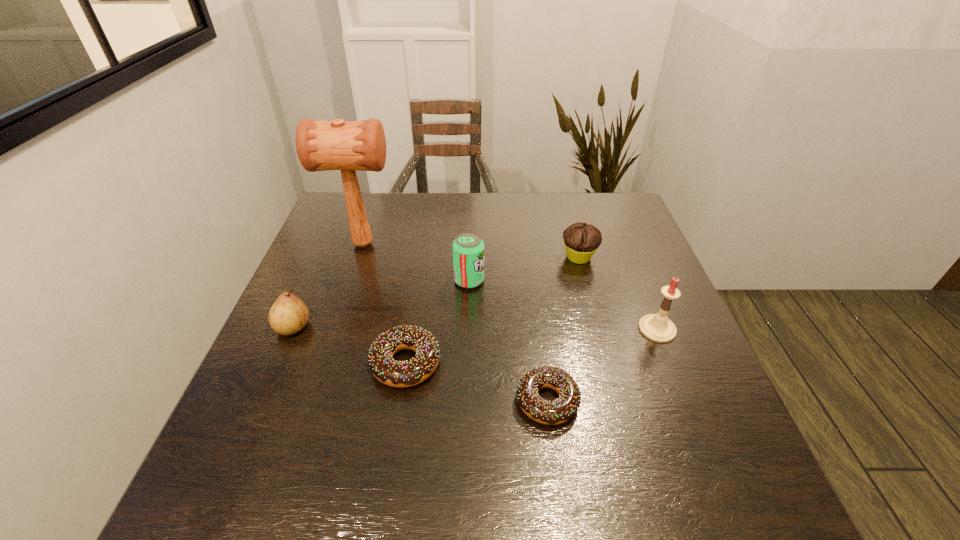
This screenshot has width=960, height=540. I want to click on pear, so click(x=289, y=314).

Where is `vacant space located on the left of the second shortest object`? The image size is (960, 540). vacant space located on the left of the second shortest object is located at coordinates (269, 363).

The width and height of the screenshot is (960, 540). Find the location of `free space located 0.210m on the left of the shortest object`. free space located 0.210m on the left of the shortest object is located at coordinates (410, 401).

Locate an element on the screen. free spot located on the strike surface of the tallest object is located at coordinates (504, 244).

Where is `free region located on the front-facing side of the pop soda`? The width and height of the screenshot is (960, 540). free region located on the front-facing side of the pop soda is located at coordinates (572, 281).

Where is `vacant space located 0.090m on the back of the rightmost object`? vacant space located 0.090m on the back of the rightmost object is located at coordinates [x=641, y=291].

Image resolution: width=960 pixels, height=540 pixels. I want to click on blank space located on the front of the fifth tallest object, so click(588, 294).

The width and height of the screenshot is (960, 540). In order to click on vacant space located 0.320m on the back of the pear in this screenshot , I will do `click(332, 236)`.

The image size is (960, 540). I want to click on object at the far edge, so click(x=321, y=145).

At what (x,y) coordinates should I click in order to perform the action: click on object that is at the near edge. Please return your answer as a coordinate pair (x, y). The height and width of the screenshot is (540, 960). Looking at the image, I should click on click(x=561, y=410).